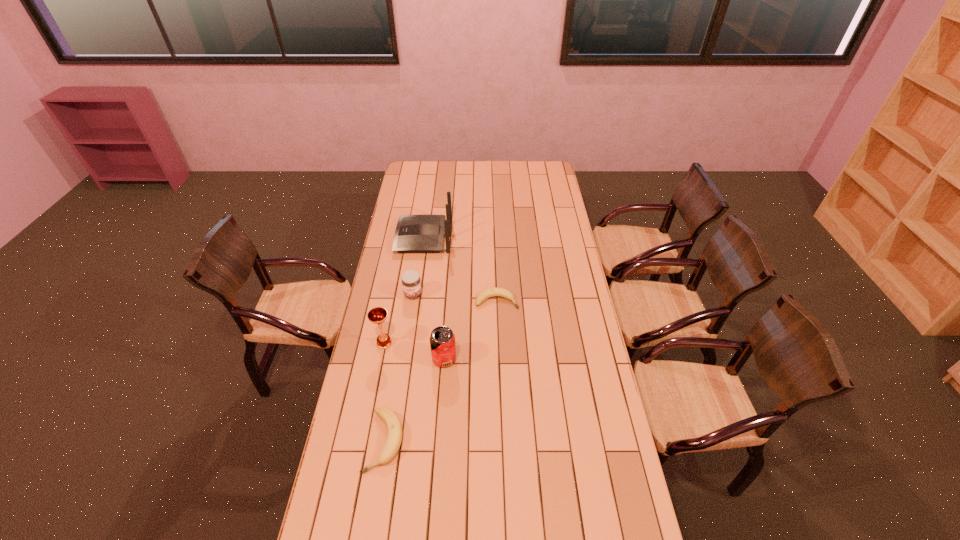
Locate an element on the screen. Image resolution: width=960 pixels, height=540 pixels. vacant space situated 0.140m at the stem of the rightmost object is located at coordinates (550, 301).

Where is `free space located on the front label of the third shortest object`? The width and height of the screenshot is (960, 540). free space located on the front label of the third shortest object is located at coordinates (410, 319).

At what (x,y) coordinates should I click in order to perform the action: click on vacant point located on the front of the chalice. Please return your answer as a coordinate pair (x, y). Image resolution: width=960 pixels, height=540 pixels. Looking at the image, I should click on (377, 381).

This screenshot has height=540, width=960. I want to click on vacant space situated 0.130m on the left of the fourth shortest object, so click(x=398, y=359).

The height and width of the screenshot is (540, 960). I want to click on banana at the left edge, so click(x=394, y=428).

Locate an element on the screen. jam that is at the left edge is located at coordinates (411, 282).

Find the location of `router present at the left edge`. router present at the left edge is located at coordinates (414, 233).

The image size is (960, 540). I want to click on chalice that is at the left edge, so (x=377, y=315).

Find the location of a particular element. The height and width of the screenshot is (540, 960). free space at the far edge of the desktop is located at coordinates (525, 171).

Locate an element on the screen. The width and height of the screenshot is (960, 540). vacant area at the near edge of the desktop is located at coordinates (489, 517).